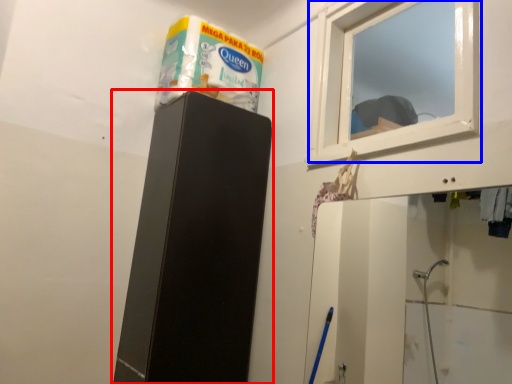
Question: Which point is closer to the camera, furniture (highlighted by a red box) or window (highlighted by a blue box)?

Choices:
 (A) furniture
 (B) window

Answer: (B)